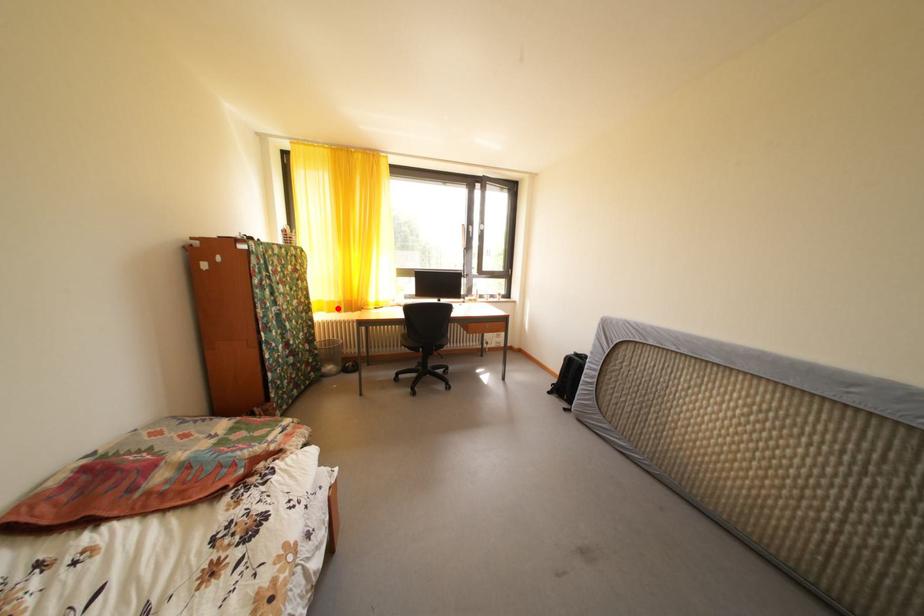
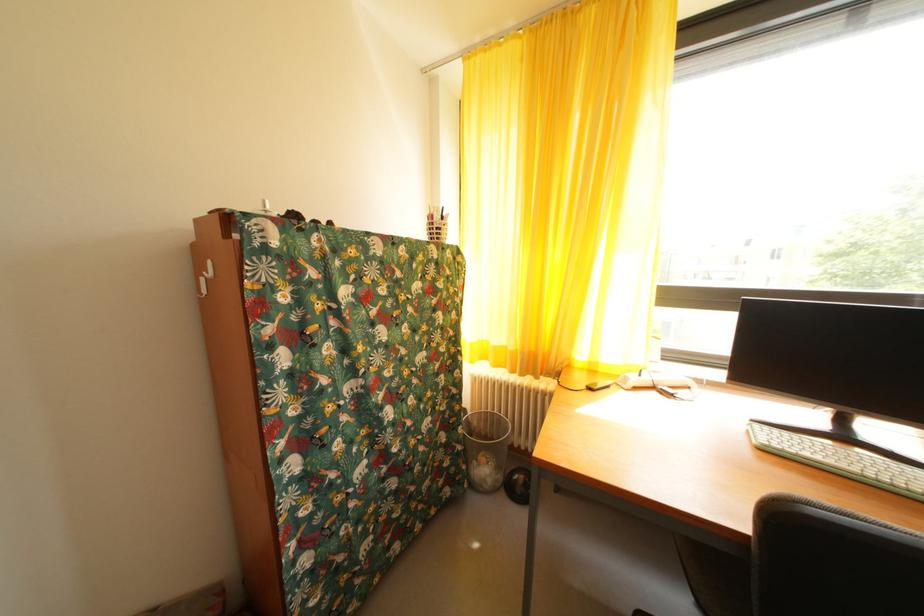
Question: I am providing you with two images of the same scene from different viewpoints. A red point is marked on the first image. At the location where the point appears in image 1, is it still visible in image 2?

Choices:
 (A) Yes
 (B) No

Answer: (A)